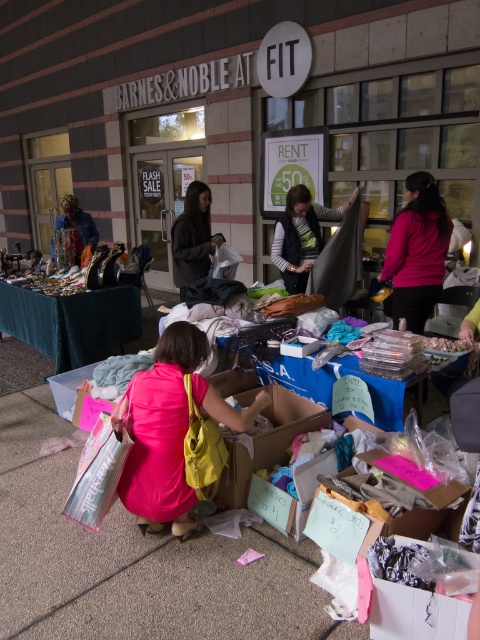
You are organizing a clothing swap event and need to arrange items for display. You have a pink fabric dress at center and a pink fabric at center. Which item should you place closer to the entrance to make it more visible?

The pink fabric dress at center should be placed closer to the entrance because it is already positioned in front of the pink fabric at center, making it naturally more visible.

You are a participant in the clothing swap event at the Barnes and Noble store. You see a pink fabric dress at center and a pink fabric at center. If you want to pick up both items, how much distance do you need to cover between them?

The pink fabric dress at center and pink fabric at center are 1.96 meters apart from each other, so you need to cover 1.96 meters distance between them.

You are organizing a clothing donation event and need to decide which item to place first in a narrow display area. Given the pink fabric at center and the velvet green scarf at center, which item should you place first to ensure it fits better in the space?

The pink fabric at center has a smaller width than the velvet green scarf at center, so you should place the pink fabric at center first to ensure it fits better in the narrow display area.